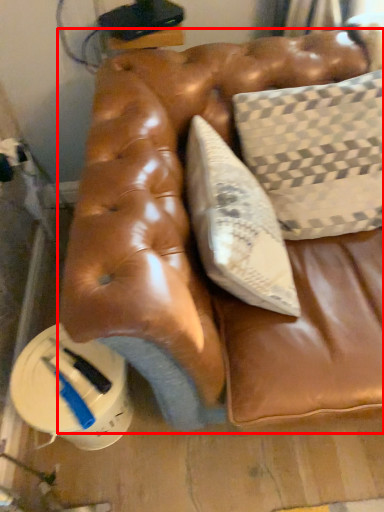
Question: In this image, where is furniture (annotated by the red box) located relative to pillow?

Choices:
 (A) right
 (B) left

Answer: (B)